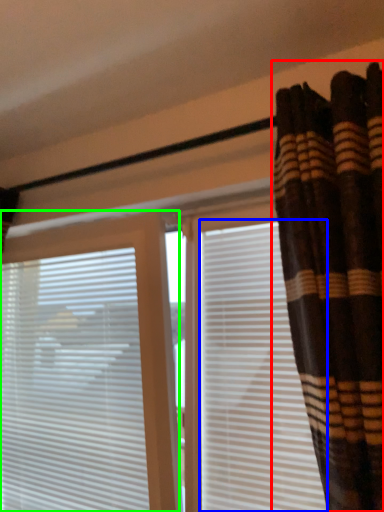
Question: Which object is the closest to the curtain (highlighted by a red box)? Choose among these: shutter (highlighted by a blue box) or window blind (highlighted by a green box).

Choices:
 (A) shutter
 (B) window blind

Answer: (A)